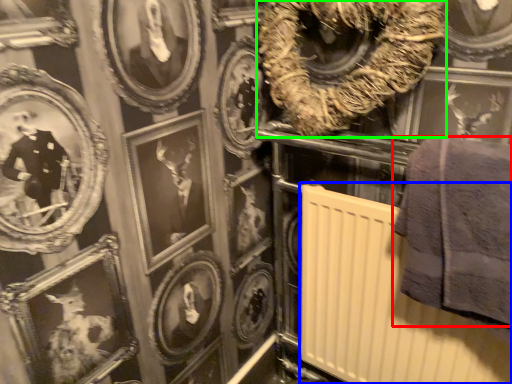
Question: Considering the real-world distances, which object is farthest from towel (highlighted by a red box)? radiator (highlighted by a blue box) or decor (highlighted by a green box)?

Choices:
 (A) radiator
 (B) decor

Answer: (B)